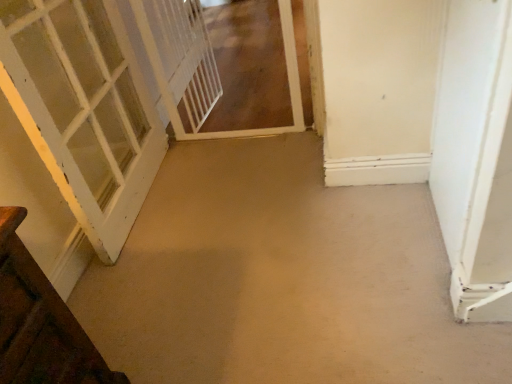
Where is `free space to the left of white matte door at right, the 1th door when ordered from right to left`? This screenshot has height=384, width=512. free space to the left of white matte door at right, the 1th door when ordered from right to left is located at coordinates (360, 242).